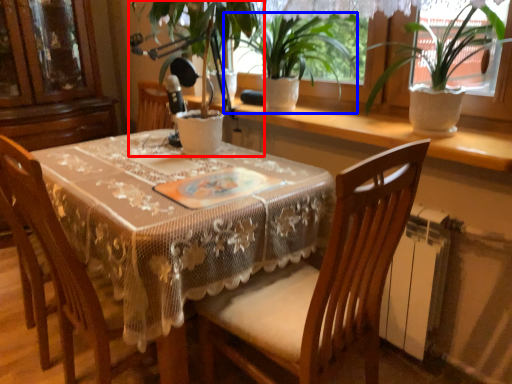
Question: Among these objects, which one is nearest to the camera, houseplant (highlighted by a red box) or houseplant (highlighted by a blue box)?

Choices:
 (A) houseplant
 (B) houseplant

Answer: (A)